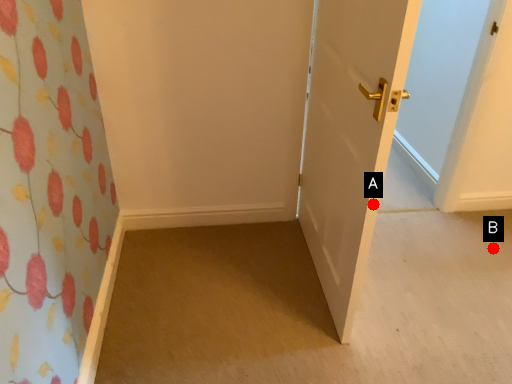
Question: Two points are circled on the image, labeled by A and B beside each circle. Which point appears closest to the camera in this image?

Choices:
 (A) A is closer
 (B) B is closer

Answer: (A)